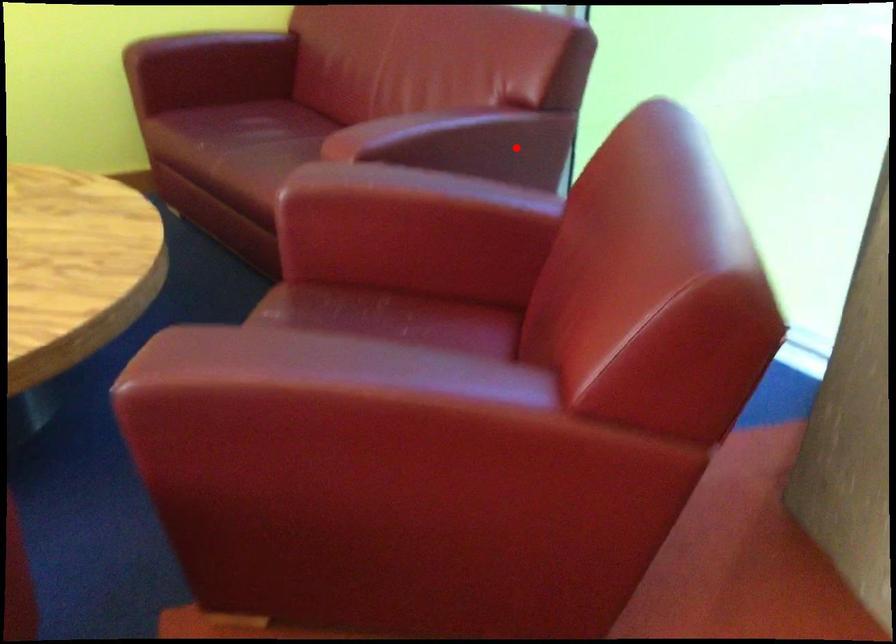
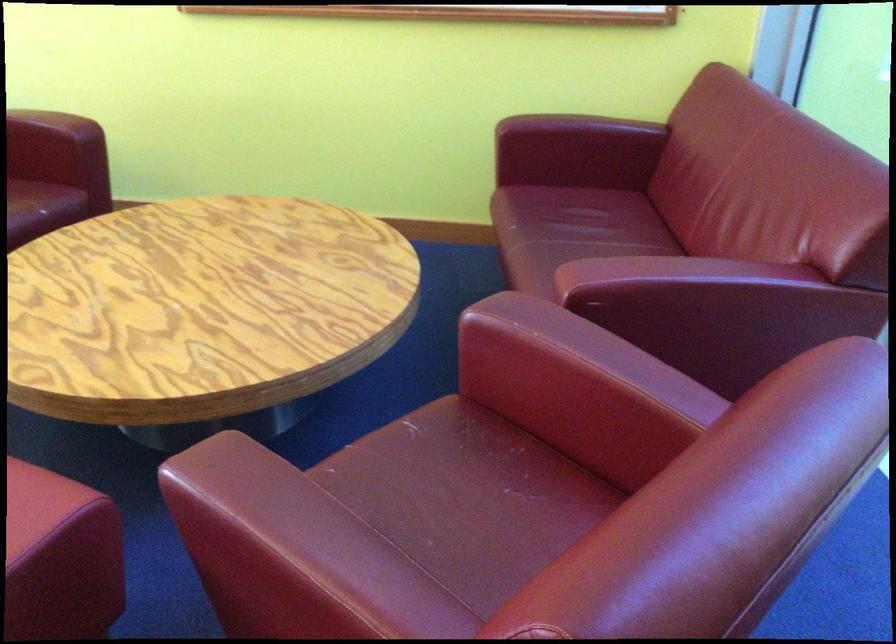
Question: I am providing you with two images of the same scene from different viewpoints. In image1, a red point is highlighted. Considering the same 3D point in image2, which of the following is correct?

Choices:
 (A) It is closer
 (B) It is farther

Answer: (A)